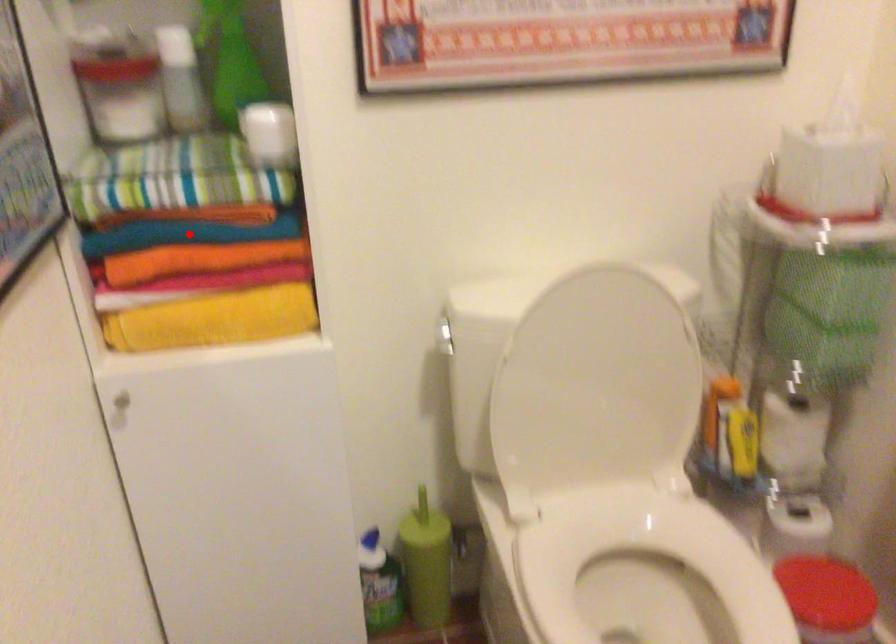
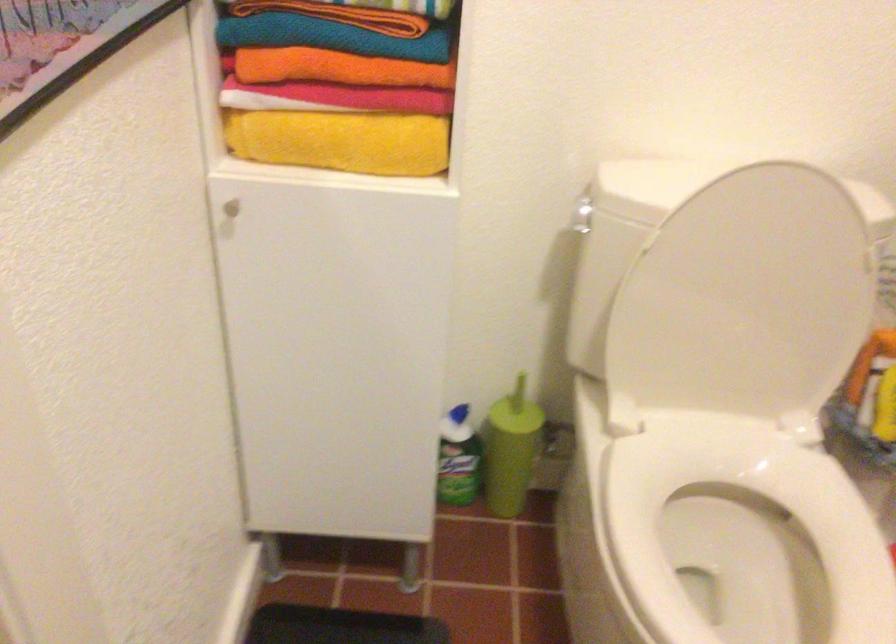
Where in the second image is the point corresponding to the highlighted location from the first image?

(331, 37)